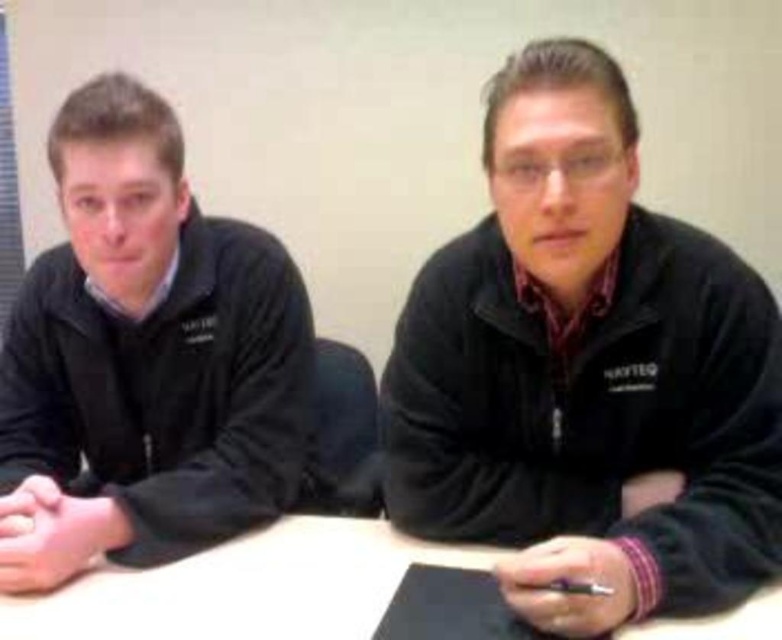
You are a photographer setting up for a group photo. You notice the black fleece jacket at center and the white matte table at center in the scene. Which object is positioned higher relative to the other?

The black fleece jacket at center is above the white matte table at center, so it is positioned higher.

Based on the scene description, where is the black fleece jacket at center located in terms of coordinates?

The black fleece jacket at center is located at coordinates point (585, 371).

You are standing at the point labeled point (508, 161) and want to move to the point labeled point (185, 372). According to the scene description, which direction should you move to reach your destination?

To move from point (508, 161) to point (185, 372), you should move downward and to the right since point (508, 161) is in front of point (185, 372).